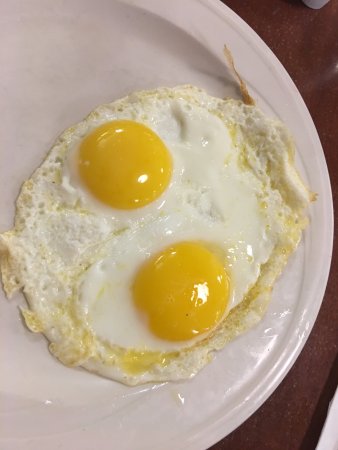
Identify the location of shadow from plate on table. (317, 428).